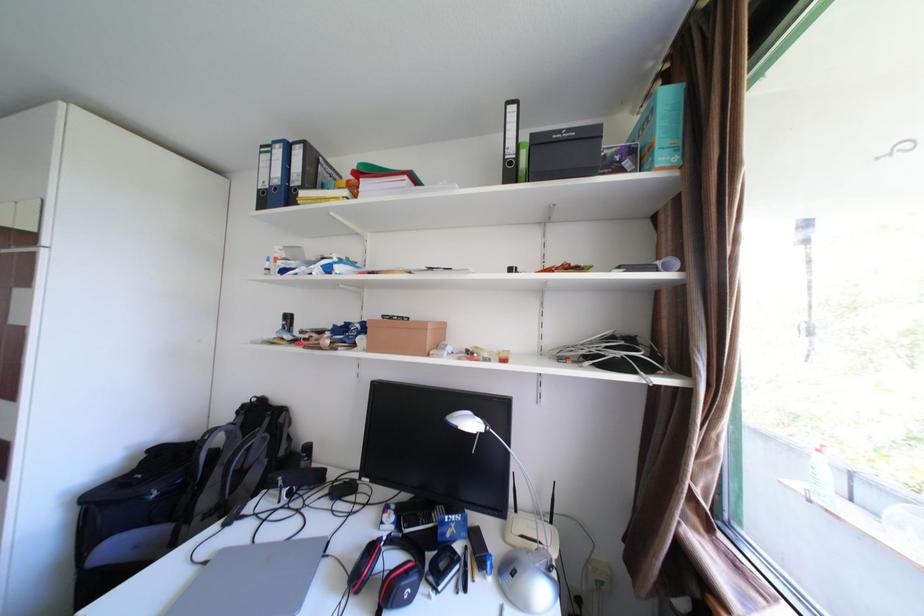
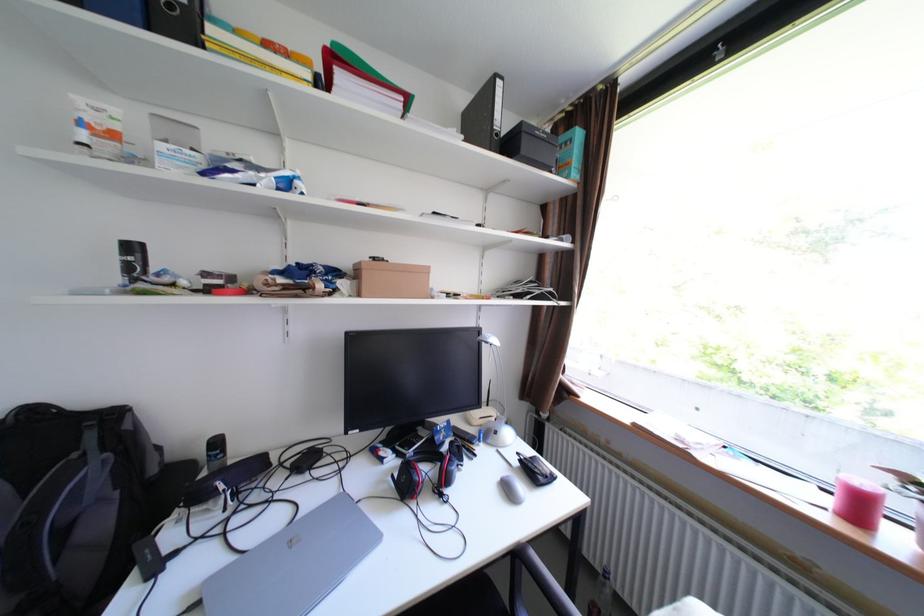
The point at (292, 484) is marked in the first image. Where is the corresponding point in the second image?

(233, 488)